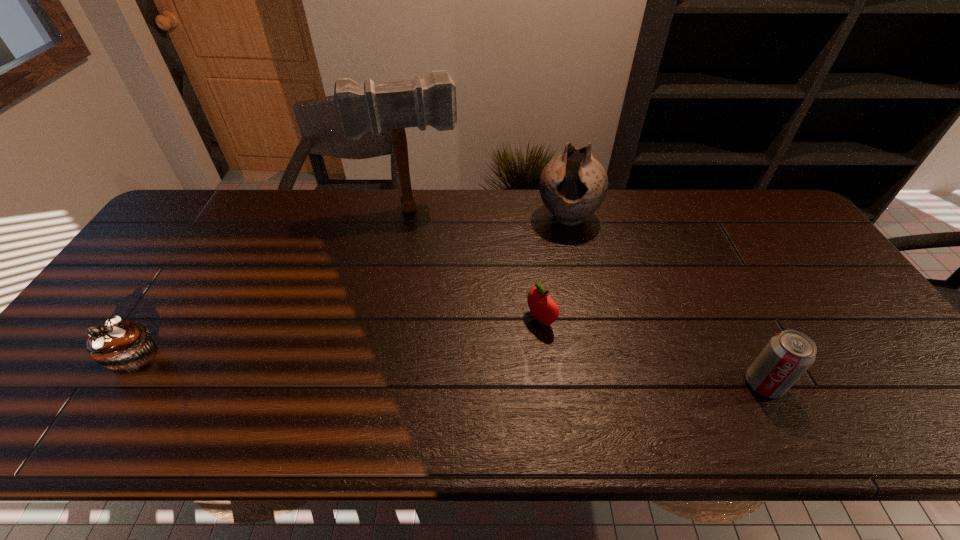
At what (x,y) coordinates should I click in order to perform the action: click on vacant space on the desktop that is between the leftmost object and the third tallest object and is positioned on the front-facing side of the apple. Please return your answer as a coordinate pair (x, y). Looking at the image, I should click on (454, 371).

At what (x,y) coordinates should I click in order to perform the action: click on free space on the desktop that is between the leftmost object and the rightmost object and is positioned from the spout of the fourth shortest object. Please return your answer as a coordinate pair (x, y). This screenshot has height=540, width=960. Looking at the image, I should click on (516, 374).

Find the location of a particular element. This screenshot has height=540, width=960. free space on the desktop that is between the cupcake and the rightmost object and is positioned at the head of the fourth object from right to left is located at coordinates (438, 370).